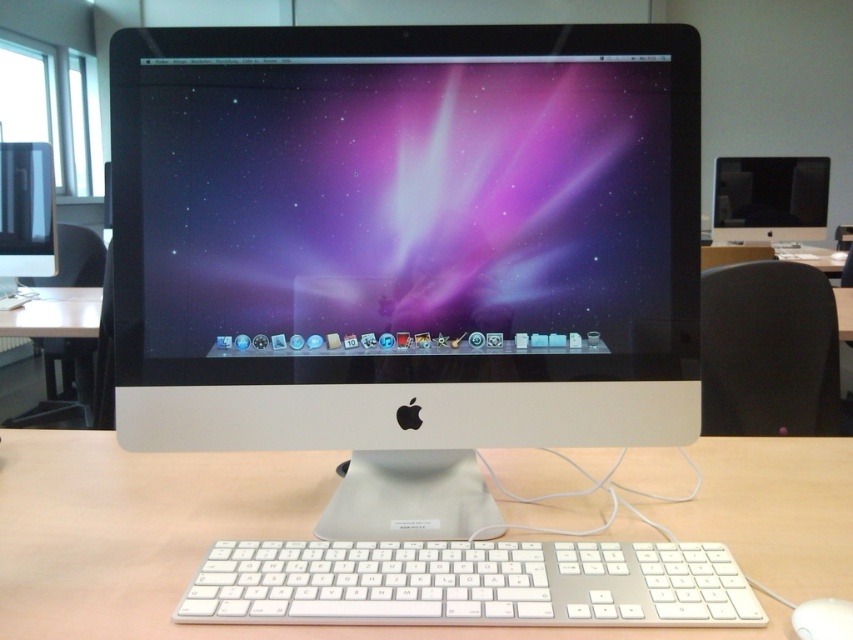
You are setting up a new monitor that requires 1 meter of space. You have the white wooden table at lower left and the white plastic mouse at lower right. Which object can accommodate the monitor based on their widths?

The white wooden table at lower left might be wider than the white plastic mouse at lower right, so it can accommodate the monitor.

You are a delivery person who needs to place a rectangular box measuring 9 feet in length between the matte black monitor at left and the white plastic mouse at lower right on the desk. Based on the desk layout shown in the image, will the box fit horizontally between these two objects without overlapping them?

The distance between the matte black monitor at left and the white plastic mouse at lower right is 8.67 feet, which is shorter than the 9 feet length of the box. Therefore, the box will not fit horizontally between them without overlapping.

You are organizing your desk and notice the white wooden table at lower left and the white plastic mouse at lower right. Which object is closer to you from your perspective?

The white wooden table at lower left is closer to you because it is positioned over the white plastic mouse at lower right, indicating it is in front of it.